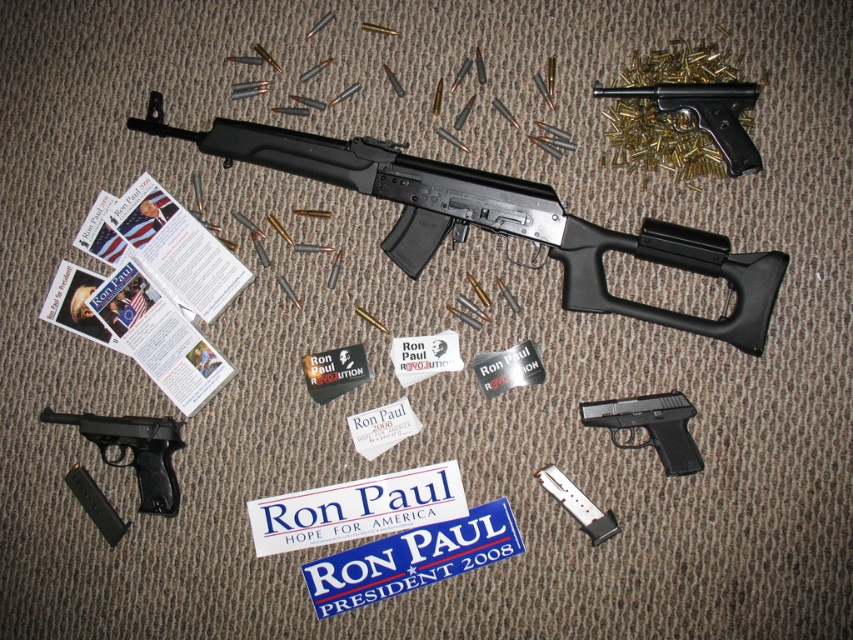
You are a collector organizing your display. You need to place a new item between the black plastic handgun at lower left and the matte black handgun at upper right. Based on their positions, which side should you place the new item to maintain symmetry?

The black plastic handgun at lower left is to the left of the matte black handgun at upper right, so placing the new item between them would require positioning it to the right of the black plastic handgun at lower left and to the left of the matte black handgun at upper right to maintain symmetry.

You are a collector who wants to store the black plastic handgun at lower left and the black plastic handgun at center in a display case. Which handgun requires a larger compartment in the display case?

The black plastic handgun at lower left requires a larger compartment because it is larger in size than the black plastic handgun at center.

You are a security guard inspecting the display. You need to move the black plastic rifle at center to a different shelf. Before moving, you notice the black plastic handgun at lower left. Which direction should you move the rifle to avoid it?

The black plastic rifle at center is above the black plastic handgun at lower left. To avoid the handgun, you should move the rifle downward or to the side away from the handgun.